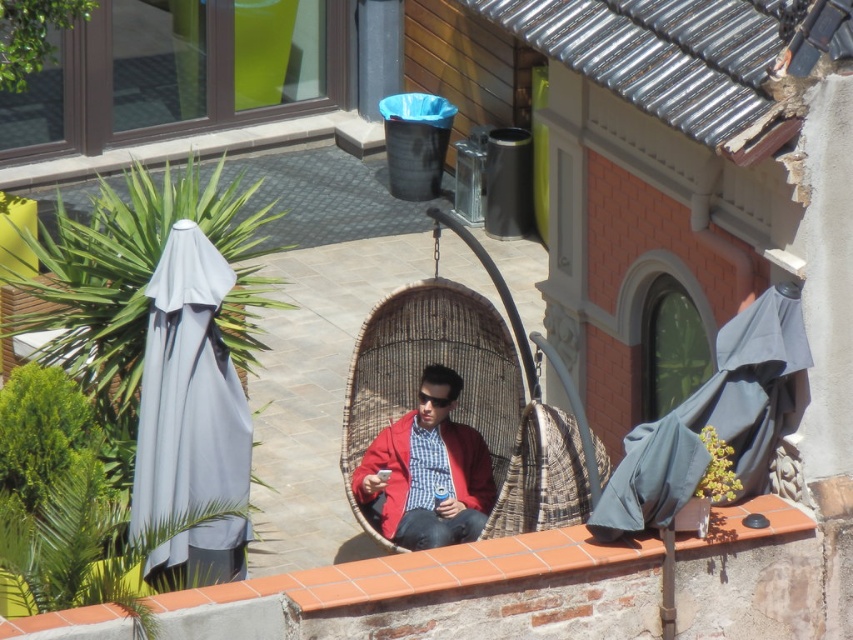
From the picture: Does terracotta brick ledge at lower center appear under dark gray fabric umbrella at right?

Indeed, terracotta brick ledge at lower center is positioned under dark gray fabric umbrella at right.

Who is shorter, terracotta brick ledge at lower center or dark gray fabric umbrella at right?

Standing shorter between the two is terracotta brick ledge at lower center.

Identify the location of terracotta brick ledge at lower center. The image size is (853, 640). (440, 595).

Find the location of a particular element. This screenshot has width=853, height=640. terracotta brick ledge at lower center is located at coordinates (440, 595).

Is woven rattan chair at center positioned behind gray fabric umbrella at left?

Yes.

Is woven rattan chair at center wider than gray fabric umbrella at left?

Indeed, woven rattan chair at center has a greater width compared to gray fabric umbrella at left.

Where is `woven rattan chair at center`? The image size is (853, 640). woven rattan chair at center is located at coordinates (463, 404).

Between woven rattan chair at center and dark gray fabric umbrella at right, which one appears on the right side from the viewer's perspective?

dark gray fabric umbrella at right

Is point (514, 369) positioned after point (782, 305)?

Yes, it is behind point (782, 305).

Does point (514, 472) come behind point (775, 346)?

Yes, point (514, 472) is farther from viewer.

You are a GUI agent. You are given a task and a screenshot of the screen. Output one action in this format:
    pyautogui.click(x=<x>, y=<y>)
    Task: Click on the woven rattan chair at center
    The image size is (853, 640).
    Given the screenshot: What is the action you would take?
    pyautogui.click(x=463, y=404)